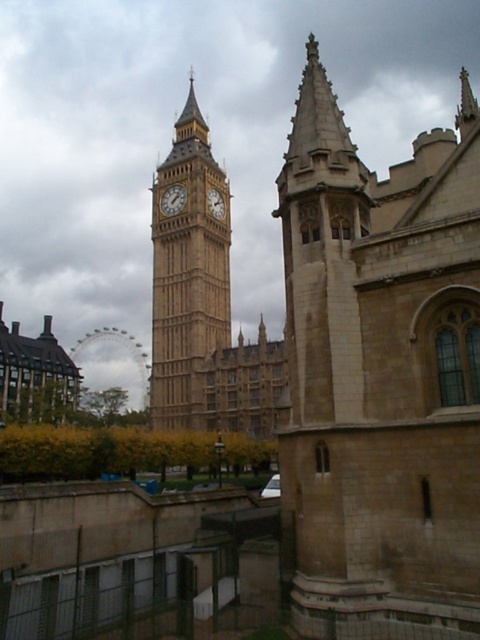
You are standing at the base of the beige stone tower at upper right and want to throw a ball to a friend who is 33.51 meters away from you. Will the ball reach your friend if you throw it horizontally?

The beige stone tower at upper right and viewer are 33.51 meters apart from each other. If you throw the ball horizontally from the base of the beige stone tower at upper right, it will reach your friend who is 33.51 meters away.